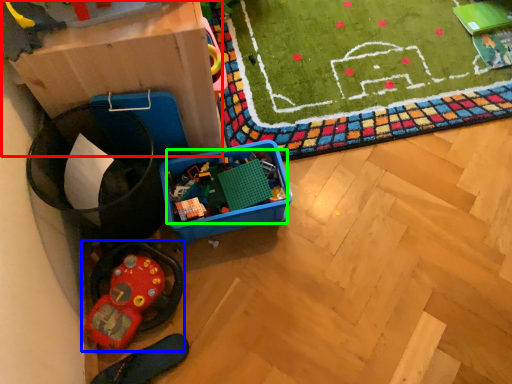
Question: Which is nearer to the cardboard box (highlighted by a red box)? toy (highlighted by a blue box) or toy (highlighted by a green box).

Choices:
 (A) toy
 (B) toy

Answer: (B)